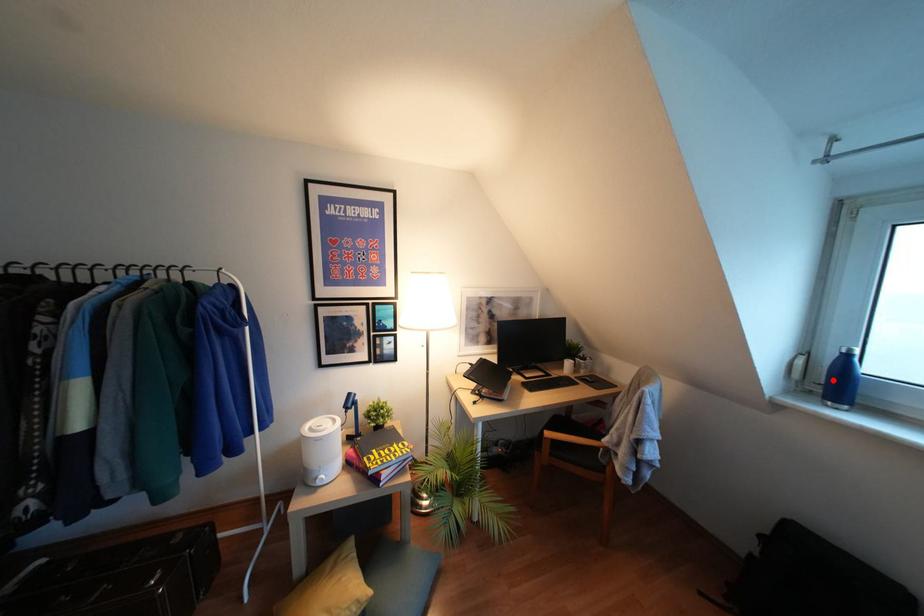
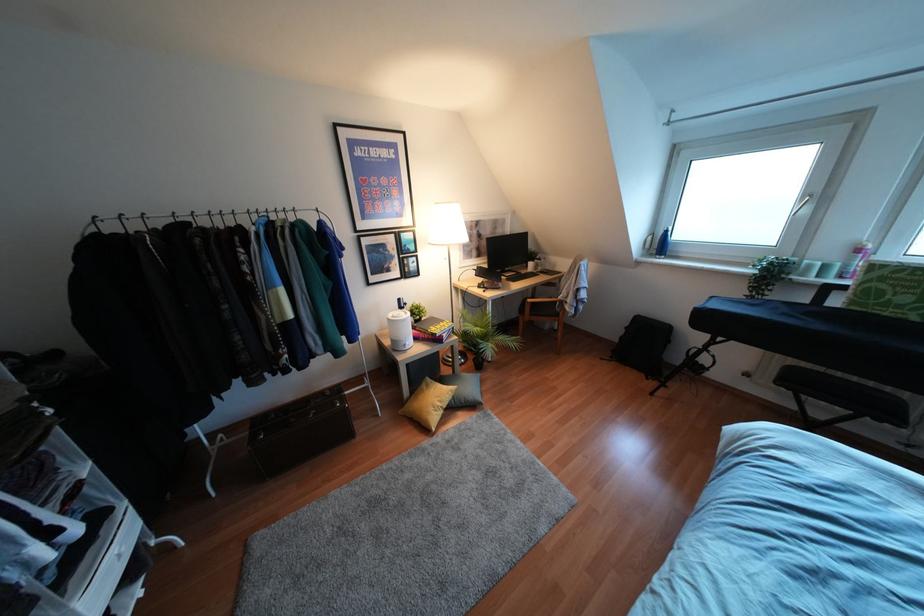
In the second image, find the point that corresponds to the highlighted location in the first image.

(660, 245)